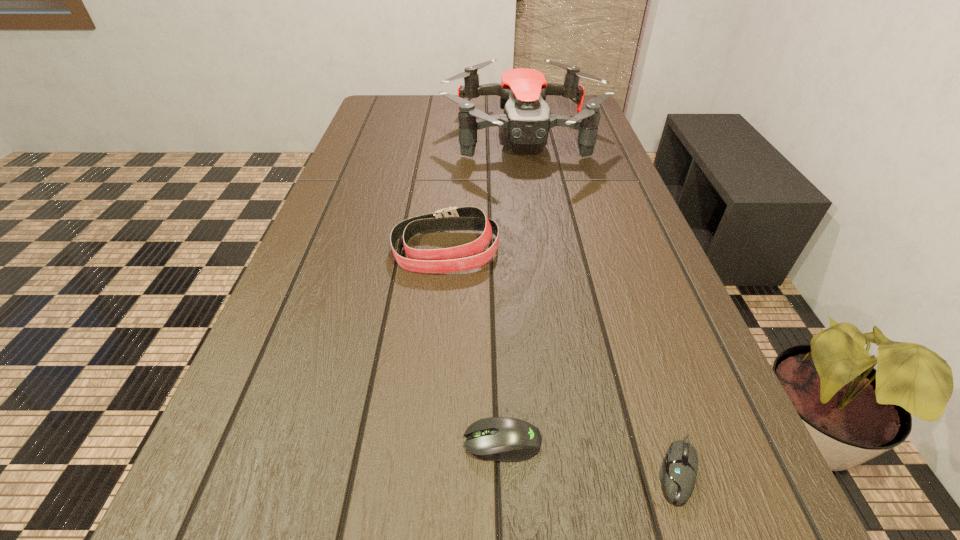
Image resolution: width=960 pixels, height=540 pixels. Identify the location of vacant area that lies between the left computer mouse and the shortest object. (590, 455).

The width and height of the screenshot is (960, 540). I want to click on vacant space that's between the left computer mouse and the tallest object, so click(513, 288).

Where is `vacant space that's between the farthest object and the shortest object`? Image resolution: width=960 pixels, height=540 pixels. vacant space that's between the farthest object and the shortest object is located at coordinates (600, 301).

This screenshot has width=960, height=540. In order to click on vacant space in between the left computer mouse and the shortest object in this screenshot , I will do `click(590, 455)`.

This screenshot has height=540, width=960. In order to click on free spot between the left computer mouse and the dog collar in this screenshot , I will do `click(474, 346)`.

You are a GUI agent. You are given a task and a screenshot of the screen. Output one action in this format:
    pyautogui.click(x=<x>, y=<y>)
    Task: Click on the vacant area that lies between the tallest object and the right computer mouse
    The height and width of the screenshot is (540, 960).
    Given the screenshot: What is the action you would take?
    pyautogui.click(x=600, y=301)

Select which object appears as the closest to the tallest object. Please provide its 2D coordinates. Your answer should be formatted as a tuple, i.e. [(x, y)], where the tuple contains the x and y coordinates of a point satisfying the conditions above.

[(466, 257)]

Image resolution: width=960 pixels, height=540 pixels. In order to click on object that stands as the third closest to the right computer mouse in this screenshot , I will do `click(526, 120)`.

In order to click on vacant space that satisfies the following two spatial constraints: 1. on the wheel side of the left computer mouse; 2. on the left side of the right computer mouse in this screenshot , I will do (503, 469).

Identify the location of free spot that satisfies the following two spatial constraints: 1. on the camera side of the farthest object; 2. on the right side of the shorter computer mouse. (576, 469).